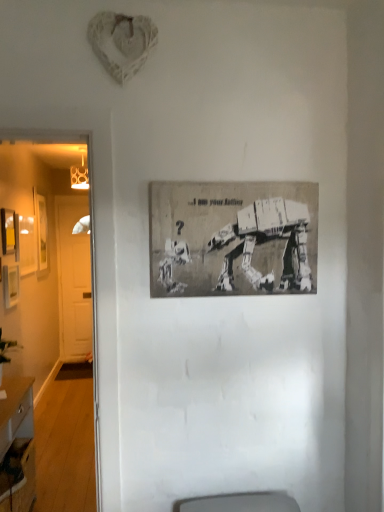
You are a GUI agent. You are given a task and a screenshot of the screen. Output one action in this format:
    pyautogui.click(x=<x>, y=<y>)
    Task: Click on the empty space that is ontop of gray paper poster at center, the 4th picture frame positioned from the back
    
    Given the screenshot: What is the action you would take?
    pyautogui.click(x=238, y=182)